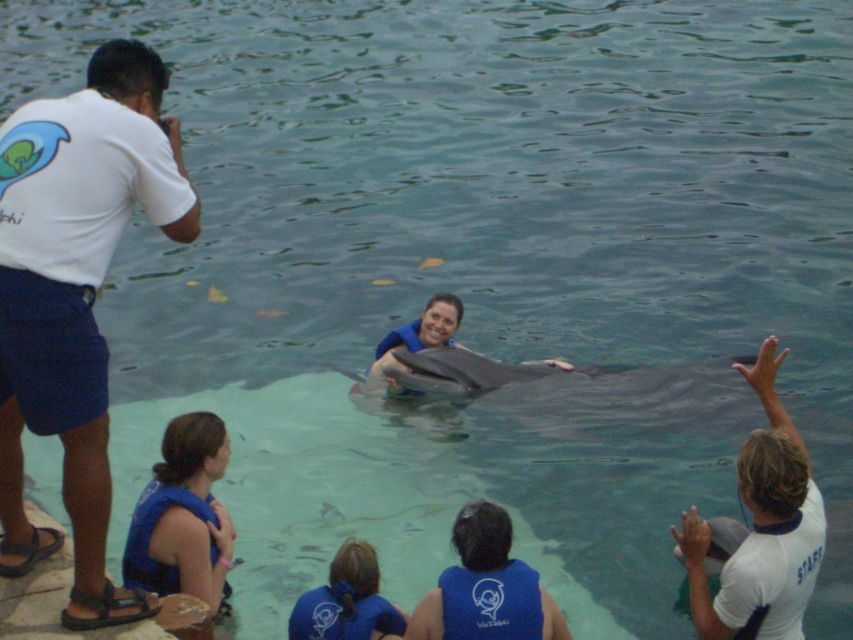
Question: Does white t-shirt at left appear over blue life vest at lower left?

Choices:
 (A) no
 (B) yes

Answer: (B)

Question: Which object appears closest to the camera in this image?

Choices:
 (A) white matte shirt at upper right
 (B) gray smooth dolphin at center

Answer: (A)

Question: Does white t-shirt at left have a larger size compared to blue life vest at lower left?

Choices:
 (A) yes
 (B) no

Answer: (B)

Question: Estimate the real-world distances between objects in this image. Which object is farther from the white t-shirt at left?

Choices:
 (A) white matte shirt at upper right
 (B) blue life vest at lower left

Answer: (A)

Question: Among these objects, which one is nearest to the camera?

Choices:
 (A) white t-shirt at left
 (B) gray smooth dolphin at center
 (C) blue life vest at lower left

Answer: (A)

Question: Is blue life vest at lower left in front of gray smooth dolphin at center?

Choices:
 (A) no
 (B) yes

Answer: (B)